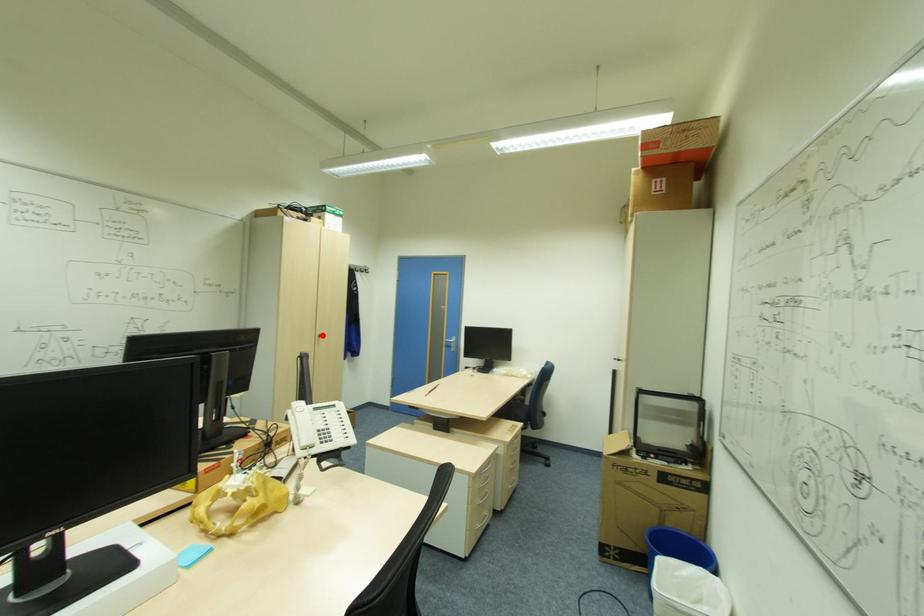
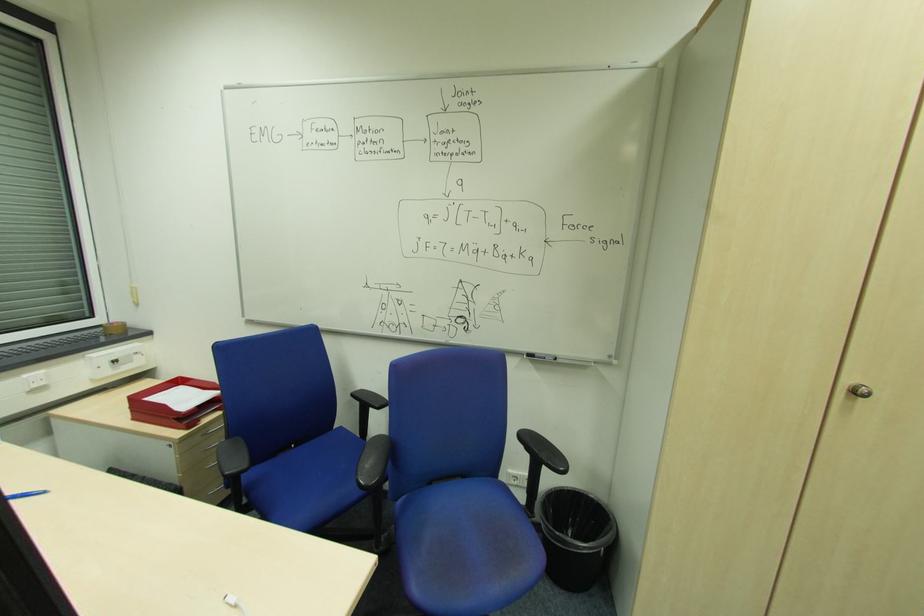
Question: I am providing you with two images of the same scene from different viewpoints. Image1 has a red point marked. In image2, the corresponding 3D location appears at what relative position? Reply with the corresponding letter.

Choices:
 (A) Closer
 (B) Farther

Answer: (A)